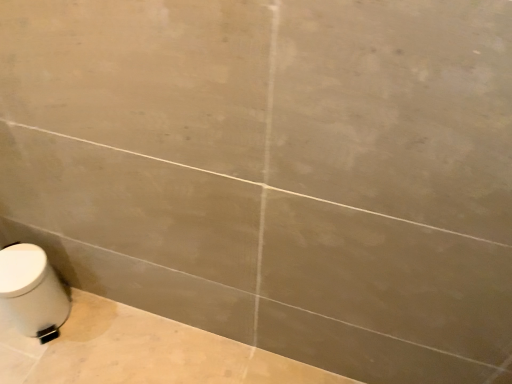
Question: Is point (38, 165) positioned closer to the camera than point (54, 284)?

Choices:
 (A) closer
 (B) farther

Answer: (A)

Question: Considering their positions, is white glossy toilet at lower left located in front of or behind white glossy toilet at lower left?

Choices:
 (A) front
 (B) behind

Answer: (A)

Question: Considering the positions of white glossy toilet at lower left and white glossy toilet at lower left in the image, is white glossy toilet at lower left taller or shorter than white glossy toilet at lower left?

Choices:
 (A) short
 (B) tall

Answer: (B)

Question: From a real-world perspective, relative to white glossy toilet at lower left, is white glossy toilet at lower left vertically above or below?

Choices:
 (A) above
 (B) below

Answer: (B)

Question: Is white glossy toilet at lower left taller or shorter than white glossy toilet at lower left?

Choices:
 (A) short
 (B) tall

Answer: (A)

Question: Visually, is white glossy toilet at lower left positioned to the left or to the right of white glossy toilet at lower left?

Choices:
 (A) left
 (B) right

Answer: (A)

Question: Is white glossy toilet at lower left bigger or smaller than white glossy toilet at lower left?

Choices:
 (A) small
 (B) big

Answer: (A)